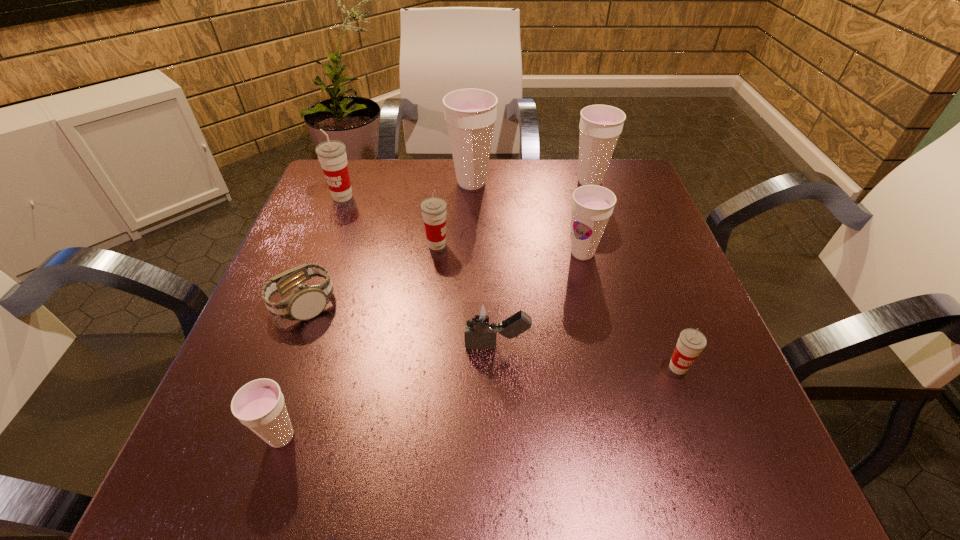
This screenshot has width=960, height=540. I want to click on the tallest object, so click(470, 114).

This screenshot has width=960, height=540. I want to click on the tallest cup, so (x=470, y=114).

This screenshot has width=960, height=540. Identify the location of the third smallest purple cup. (600, 126).

This screenshot has width=960, height=540. What are the coordinates of `the leftmost red cup` in the screenshot? It's located at (332, 156).

Find the location of `the farthest red cup`. the farthest red cup is located at coordinates (332, 156).

At what (x,y) coordinates should I click in order to perform the action: click on the second biggest red cup. Please return your answer as a coordinate pair (x, y). The width and height of the screenshot is (960, 540). Looking at the image, I should click on (433, 209).

I want to click on the second red cup from right to left, so click(x=433, y=209).

Locate an element on the screen. the second smallest purple cup is located at coordinates (592, 205).

I want to click on igniter, so click(x=481, y=323).

Locate an element on the screen. This screenshot has width=960, height=540. the smallest red cup is located at coordinates (691, 342).